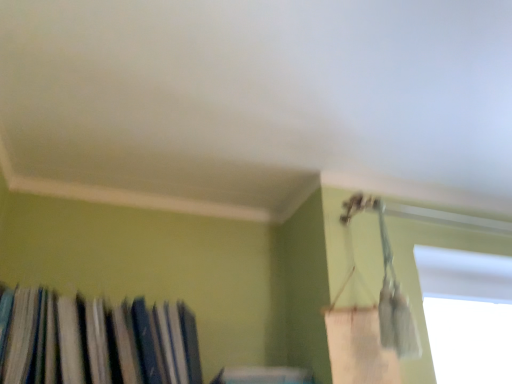
What is the approximate height of hardcover books at left?

It is 10.91 inches.

Describe the element at coordinates (95, 341) in the screenshot. I see `hardcover books at left` at that location.

Where is `hardcover books at left`? hardcover books at left is located at coordinates (95, 341).

This screenshot has height=384, width=512. I want to click on hardcover books at left, so click(95, 341).